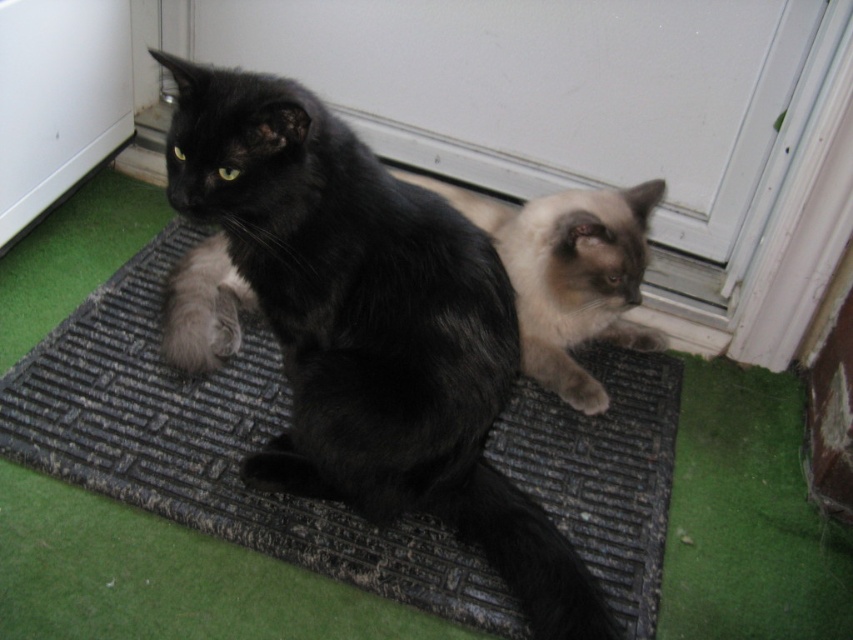
Is matte black cat at center smaller than black fur cat at center?

No, matte black cat at center is not smaller than black fur cat at center.

Which is below, matte black cat at center or black fur cat at center?

matte black cat at center is below.

The height and width of the screenshot is (640, 853). In order to click on matte black cat at center in this screenshot , I will do `click(363, 326)`.

At what (x,y) coordinates should I click in order to perform the action: click on matte black cat at center. Please return your answer as a coordinate pair (x, y). Looking at the image, I should click on (363, 326).